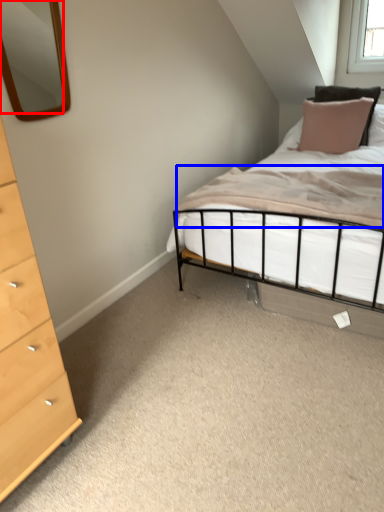
Question: Which point is closer to the camera, mirror (highlighted by a red box) or mattress (highlighted by a blue box)?

Choices:
 (A) mirror
 (B) mattress

Answer: (A)